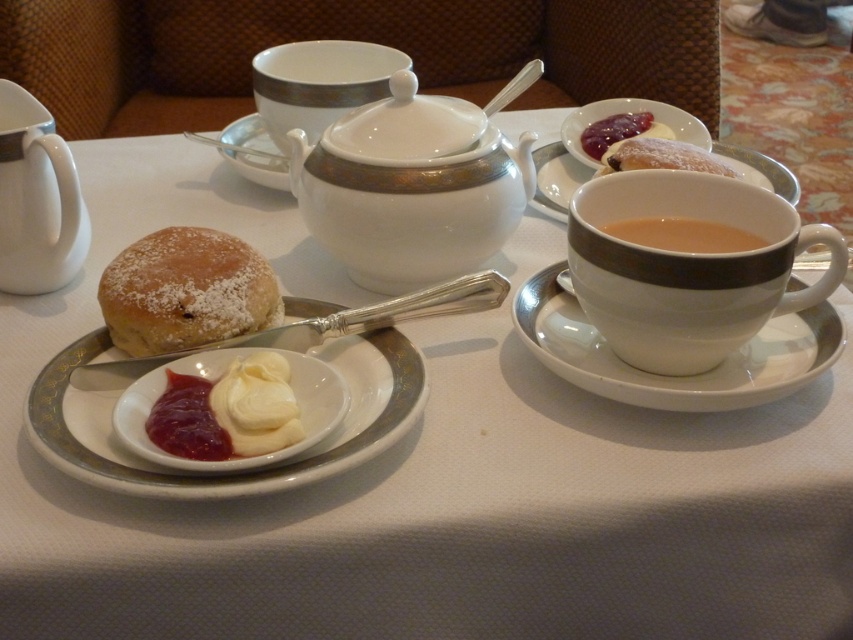
Question: Which object is closer to the camera taking this photo?

Choices:
 (A) brown matte cup at center right
 (B) smooth strawberry jam at center
 (C) white porcelain saucer at right
 (D) white porcelain saucer at upper center

Answer: (B)

Question: Is white porcelain platter at center to the right of powdered sugar pastry at lower left from the viewer's perspective?

Choices:
 (A) yes
 (B) no

Answer: (A)

Question: Which object is the farthest from the white porcelain saucer at upper center?

Choices:
 (A) white porcelain platter at center
 (B) smooth strawberry jam at center
 (C) brown matte cup at center right

Answer: (C)

Question: Can you confirm if white porcelain sugar bowl at center is positioned above brown matte cup at center right?

Choices:
 (A) no
 (B) yes

Answer: (B)

Question: Based on their relative distances, which object is nearer to the smooth strawberry jam at center?

Choices:
 (A) white glossy tea pot at left
 (B) white porcelain sugar bowl at center
 (C) white glossy cup at right
 (D) smooth white cream at center

Answer: (A)

Question: Is brown matte cup at center right to the right of smooth white cream at center from the viewer's perspective?

Choices:
 (A) no
 (B) yes

Answer: (A)